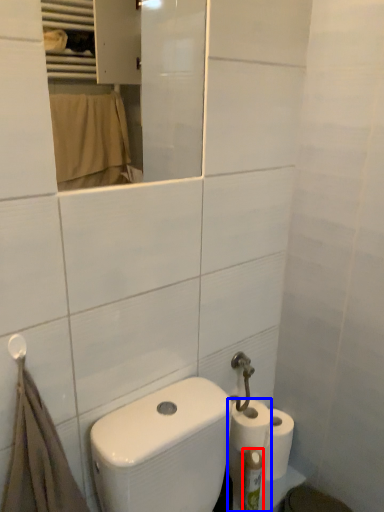
Question: Which object is further to the camera taking this photo, toiletry (highlighted by a red box) or toilet paper (highlighted by a blue box)?

Choices:
 (A) toiletry
 (B) toilet paper

Answer: (B)